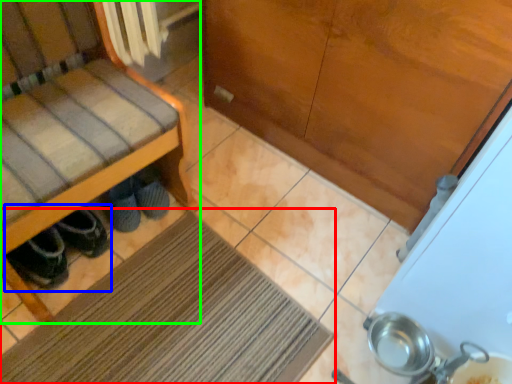
Question: Considering the real-world distances, which object is farthest from mat (highlighted by a red box)? footwear (highlighted by a blue box) or furniture (highlighted by a green box)?

Choices:
 (A) footwear
 (B) furniture

Answer: (B)